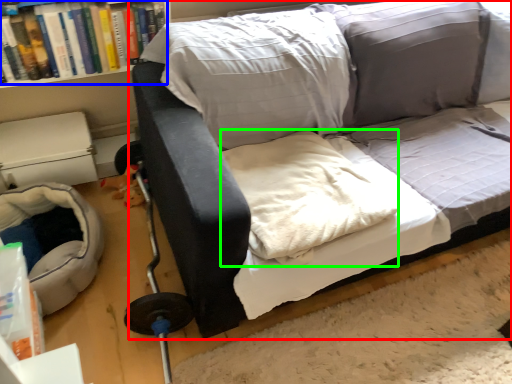
Question: Which object is positioned closest to studio couch (highlighted by a red box)? Select from book (highlighted by a blue box) and linen (highlighted by a green box).

Choices:
 (A) book
 (B) linen

Answer: (B)